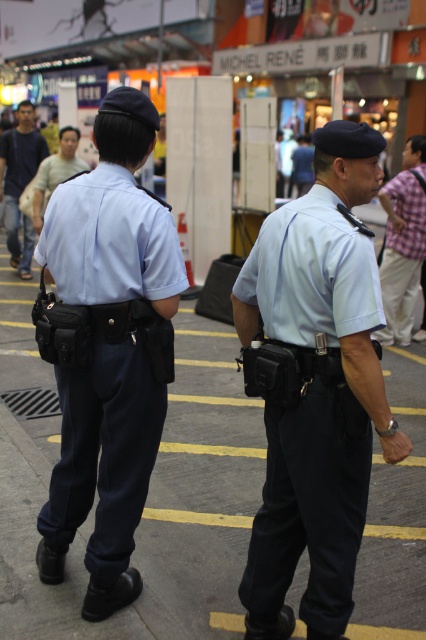
You are a fashion designer observing the image. You want to create a uniform that matches the one worn by the officers. Where should you place the light blue fabric uniform at center on a coordinate system from 0 to 1?

The light blue fabric uniform at center should be placed at coordinate point 0.706 on the x axis and 0.246 on the y axis.

Looking at this image, two officers are standing on a street. You are a pedestrian who wants to walk between them. The point between them is at point (66,285). If you are 2 meters tall, will you hit your head on anything?

The officers are 9.17 feet apart, so the distance between them is sufficient for a pedestrian to pass through without hitting their head since 9.17 feet is approximately 2.8 meters, which is more than enough space for a 2 meter tall person to walk between them.

You are a tailor measuring clothing items in the image. The light blue fabric uniform at center and the light brown leather jacket at upper left need alterations. Which item requires a shorter hem adjustment?

The light brown leather jacket at upper left requires a shorter hem adjustment because it has a smaller height than the light blue fabric uniform at center.